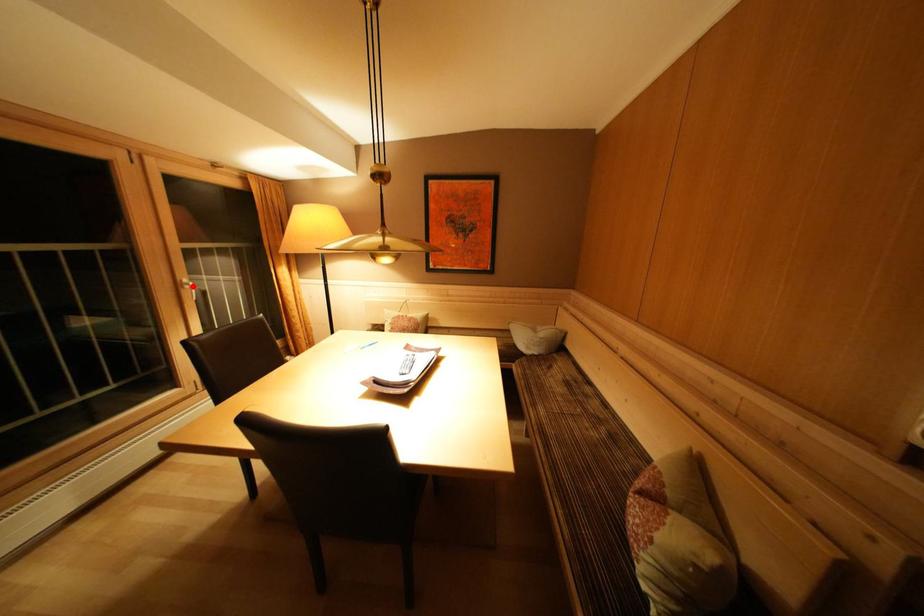
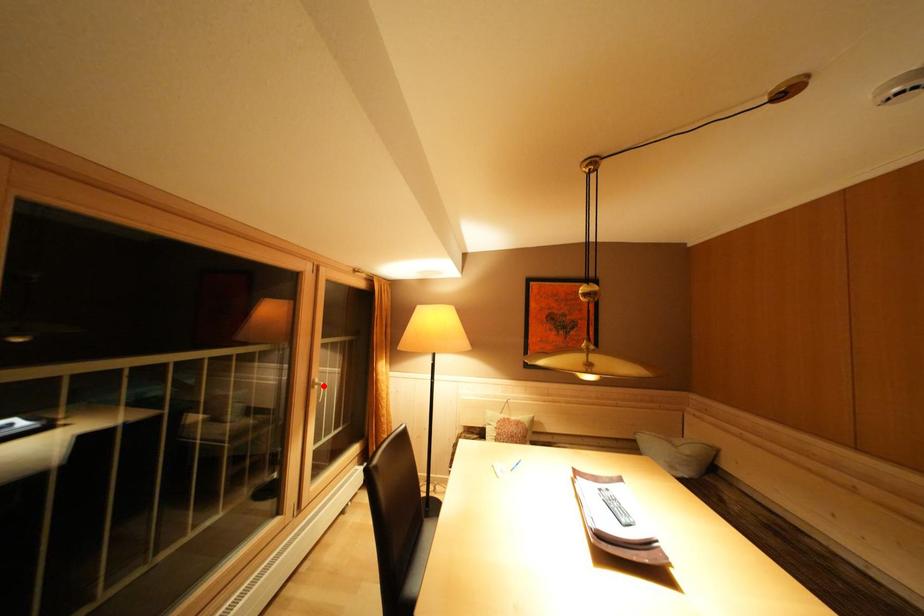
I am providing you with two images of the same scene from different viewpoints. A red point is marked on the first image and another point is marked on the second image. Is the marked point in image1 the same physical position as the marked point in image2?

Yes